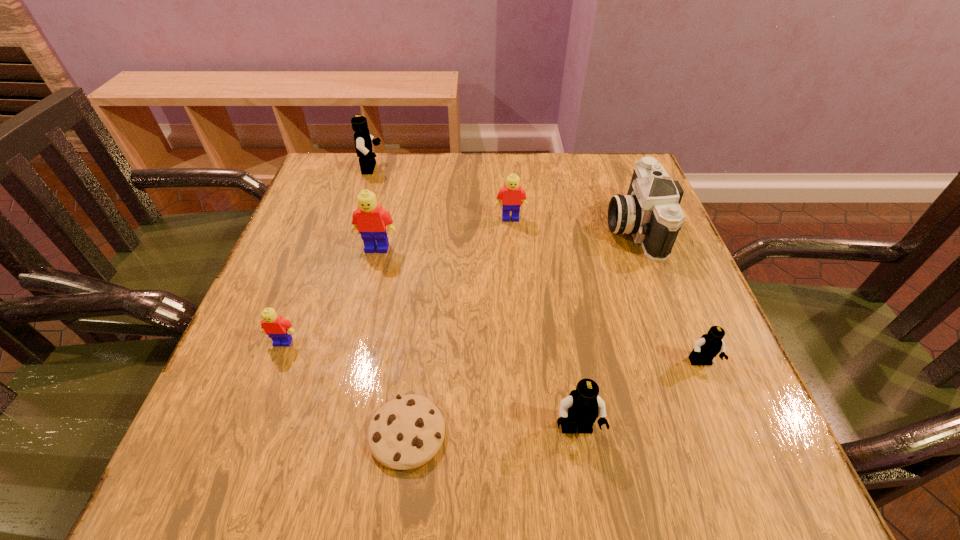
This screenshot has height=540, width=960. I want to click on the farthest object, so click(x=363, y=140).

Locate an element on the screen. the biggest black Lego is located at coordinates (363, 140).

The height and width of the screenshot is (540, 960). Identify the location of the second yellow Lego from left to right. (370, 220).

You are a GUI agent. You are given a task and a screenshot of the screen. Output one action in this format:
    pyautogui.click(x=<x>, y=<y>)
    Task: Click on the third farthest Lego
    The image size is (960, 540).
    Given the screenshot: What is the action you would take?
    pyautogui.click(x=370, y=220)

You are a GUI agent. You are given a task and a screenshot of the screen. Output one action in this format:
    pyautogui.click(x=<x>, y=<y>)
    Task: Click on the black camera
    Image resolution: width=960 pixels, height=540 pixels.
    Given the screenshot: What is the action you would take?
    pyautogui.click(x=650, y=211)

I want to click on the fourth object from right to left, so click(x=512, y=195).

Identify the location of the farthest yellow Lego. This screenshot has width=960, height=540. (512, 195).

Locate an element on the screen. This screenshot has width=960, height=540. the nearest Lego is located at coordinates (580, 409).

Locate an element on the screen. The image size is (960, 540). the second black Lego from right to left is located at coordinates (580, 409).

Where is `the smallest yellow Lego`? the smallest yellow Lego is located at coordinates (278, 329).